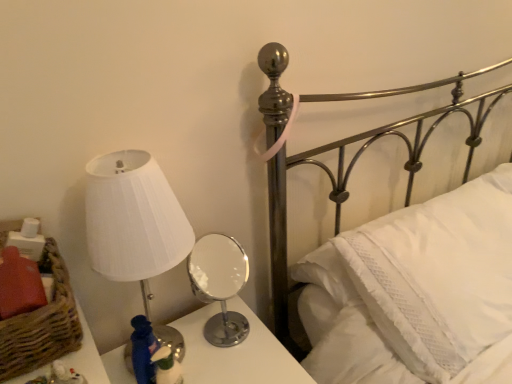
The width and height of the screenshot is (512, 384). I want to click on free space in front of metallic silver table lamp at center, so click(x=236, y=363).